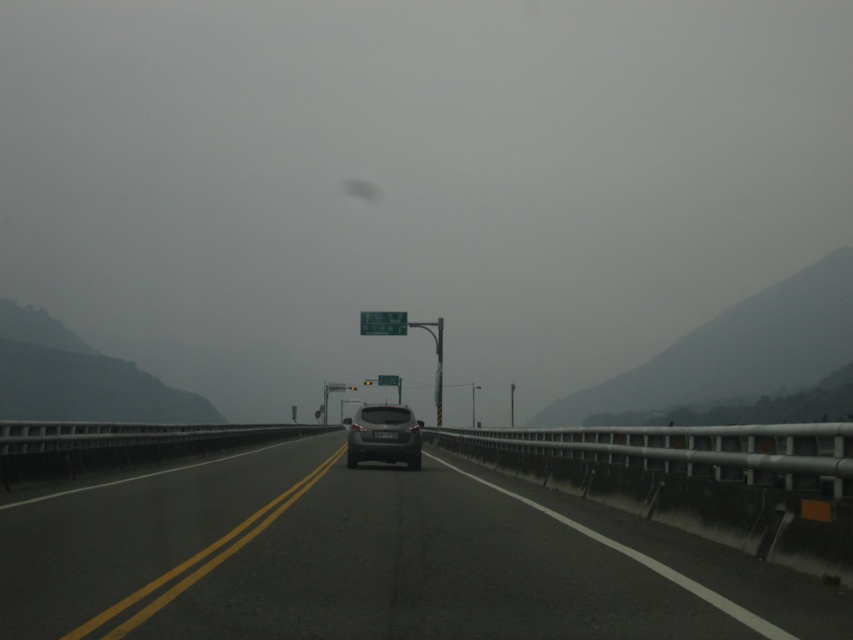
You are driving a car and notice a green plastic sign at center ahead on the highway. There is also a transparent glass windshield at center in front of you. Which object will you hit first if you continue driving straight?

The transparent glass windshield at center is positioned over the green plastic sign at center, so you will hit the transparent glass windshield at center first.

You are driving a car and see the satin black suv at center ahead on the highway. There is also gray matte fog at right in your line of sight. Which object is closer to you?

The gray matte fog at right is closer to you because it is positioned further to the viewer than the satin black suv at center.

You are driving a car and notice two objects in your view ahead. You see the transparent glass windshield at center and the green plastic sign at center. Which object is positioned to the right side from your perspective?

The transparent glass windshield at center is positioned to the right of the green plastic sign at center.